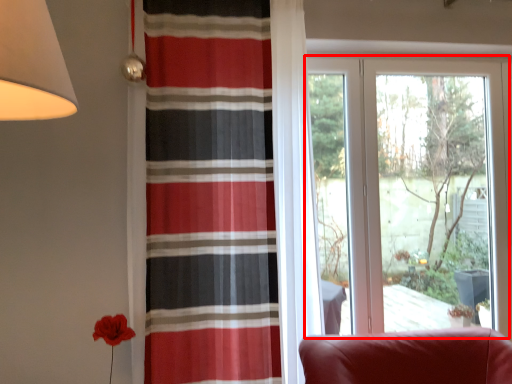
Question: From the image, what is the correct spatial relationship of window (annotated by the red box) in relation to curtain?

Choices:
 (A) left
 (B) right

Answer: (B)